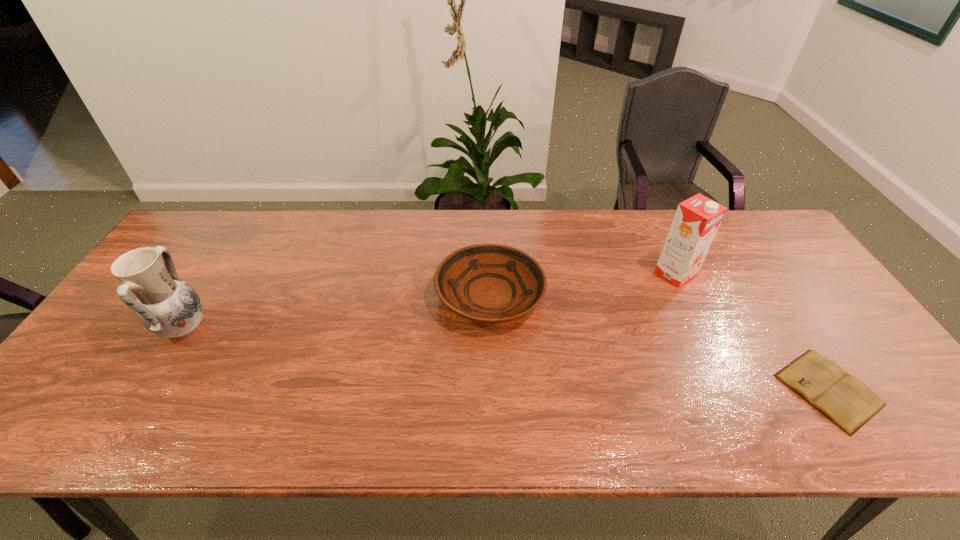
I want to click on the second object from right to left, so pyautogui.click(x=697, y=219).

I want to click on pottery, so click(168, 307).

Find the location of a particular element. This screenshot has height=540, width=960. the third object from right to left is located at coordinates (488, 283).

Find the location of `the third tallest object`. the third tallest object is located at coordinates (488, 283).

In order to click on the shortest object in this screenshot , I will do `click(849, 403)`.

Locate an element on the screen. This screenshot has height=540, width=960. the rightmost object is located at coordinates [849, 403].

The height and width of the screenshot is (540, 960). What are the coordinates of `free space located 0.220m on the right of the carton` in the screenshot? It's located at (770, 274).

What are the coordinates of `free space located on either side of the leftmost object` in the screenshot? It's located at (316, 329).

Find the location of a particular element. blank space located 0.350m on the right of the second shortest object is located at coordinates (668, 295).

Find the location of `vacant space located on the back of the rightmost object`. vacant space located on the back of the rightmost object is located at coordinates point(736,247).